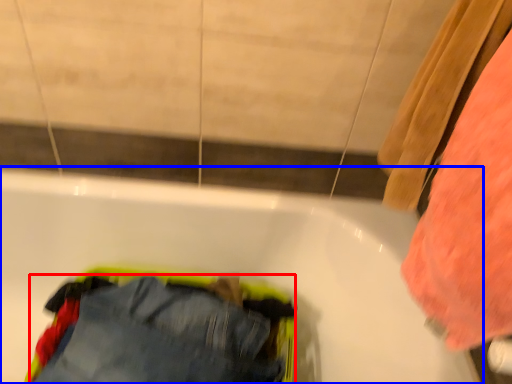
Question: Which point is further to the camera, trousers (highlighted by a red box) or bathtub (highlighted by a blue box)?

Choices:
 (A) trousers
 (B) bathtub

Answer: (A)